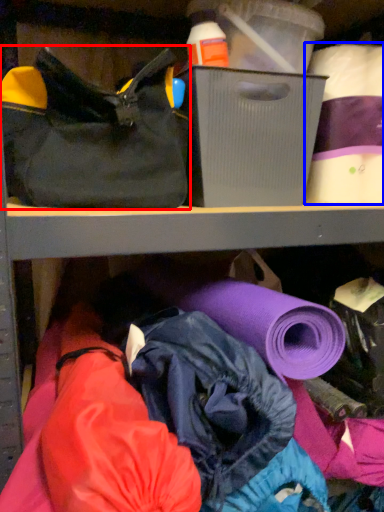
Question: Which point is further to the camera, handbag (highlighted by a red box) or toilet paper (highlighted by a blue box)?

Choices:
 (A) handbag
 (B) toilet paper

Answer: (B)